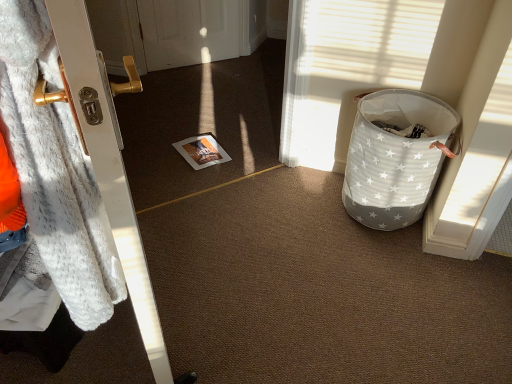
At what (x,y) coordinates should I click in order to perform the action: click on white star-patterned fabric basket at right. Please return your answer as a coordinate pair (x, y). Looking at the image, I should click on (396, 156).

From a real-world perspective, is white fur coat at left physically located above or below white star-patterned fabric basket at right?

white fur coat at left is above white star-patterned fabric basket at right.

Which object is positioned more to the left, white fur coat at left or white star-patterned fabric basket at right?

Positioned to the left is white fur coat at left.

Considering the points (130, 199) and (410, 180), which point is behind, point (130, 199) or point (410, 180)?

Point (410, 180)

Can you confirm if white fur coat at left is smaller than white star-patterned fabric basket at right?

No.

Based on the photo, from the image's perspective, is fuzzy white blanket at left located above or below white star-patterned fabric basket at right?

Clearly, from the image's perspective, fuzzy white blanket at left is below white star-patterned fabric basket at right.

Between fuzzy white blanket at left and white star-patterned fabric basket at right, which one appears on the left side from the viewer's perspective?

fuzzy white blanket at left.

Considering the relative sizes of fuzzy white blanket at left and white star-patterned fabric basket at right in the image provided, is fuzzy white blanket at left smaller than white star-patterned fabric basket at right?

Actually, fuzzy white blanket at left might be larger than white star-patterned fabric basket at right.

Which of these two, white fur coat at left or fuzzy white blanket at left, is bigger?

white fur coat at left is bigger.

From the image's perspective, does white fur coat at left appear higher than fuzzy white blanket at left?

No, from the image's perspective, white fur coat at left is not above fuzzy white blanket at left.

I want to click on door that appears below the fuzzy white blanket at left (from a real-world perspective), so click(x=106, y=158).

Considering the sizes of objects fuzzy white blanket at left and white fur coat at left in the image provided, who is bigger, fuzzy white blanket at left or white fur coat at left?

With larger size is white fur coat at left.

Which object is positioned more to the left, fuzzy white blanket at left or white fur coat at left?

Positioned to the left is fuzzy white blanket at left.

Is fuzzy white blanket at left taller than white fur coat at left?

No, fuzzy white blanket at left is not taller than white fur coat at left.

From a real-world perspective, is fuzzy white blanket at left below white fur coat at left?

No.

Which object is closer to the camera taking this photo, white star-patterned fabric basket at right or white fur coat at left?

white fur coat at left is closer to the camera.

Which of these two, white star-patterned fabric basket at right or white fur coat at left, stands shorter?

white star-patterned fabric basket at right.

From a real-world perspective, is white star-patterned fabric basket at right located beneath white fur coat at left?

Correct, in the physical world, white star-patterned fabric basket at right is lower than white fur coat at left.

Where is `trash bin/can above the white fur coat at left (from the image's perspective)`? trash bin/can above the white fur coat at left (from the image's perspective) is located at coordinates (396, 156).

How distant is white star-patterned fabric basket at right from fuzzy white blanket at left?

white star-patterned fabric basket at right is 1.21 meters from fuzzy white blanket at left.

The image size is (512, 384). I want to click on blanket located on the left of white star-patterned fabric basket at right, so click(55, 171).

Can you confirm if white star-patterned fabric basket at right is taller than fuzzy white blanket at left?

No.

From a real-world perspective, is white star-patterned fabric basket at right physically located above or below fuzzy white blanket at left?

white star-patterned fabric basket at right is situated lower than fuzzy white blanket at left in the real world.

In the image, there is a white star-patterned fabric basket at right. In order to click on door below it (from the image's perspective) in this screenshot , I will do `click(106, 158)`.

The height and width of the screenshot is (384, 512). Find the location of `blanket in front of the white star-patterned fabric basket at right`. blanket in front of the white star-patterned fabric basket at right is located at coordinates (x=55, y=171).

When comparing their distances from white fur coat at left, does white star-patterned fabric basket at right or fuzzy white blanket at left seem further?

white star-patterned fabric basket at right is further to white fur coat at left.

When comparing their distances from fuzzy white blanket at left, does white star-patterned fabric basket at right or white fur coat at left seem closer?

white fur coat at left.

Which object lies nearer to the anchor point fuzzy white blanket at left, white fur coat at left or white star-patterned fabric basket at right?

Based on the image, white fur coat at left appears to be nearer to fuzzy white blanket at left.

When comparing their distances from white star-patterned fabric basket at right, does fuzzy white blanket at left or white fur coat at left seem closer?

white fur coat at left is closer to white star-patterned fabric basket at right.

Looking at the image, which one is located closer to white star-patterned fabric basket at right, white fur coat at left or fuzzy white blanket at left?

white fur coat at left.

From the image, which object appears to be nearer to white fur coat at left, fuzzy white blanket at left or white star-patterned fabric basket at right?

The object closer to white fur coat at left is fuzzy white blanket at left.

Locate an element on the screen. This screenshot has height=384, width=512. door between fuzzy white blanket at left and white star-patterned fabric basket at right in the front-back direction is located at coordinates (106, 158).